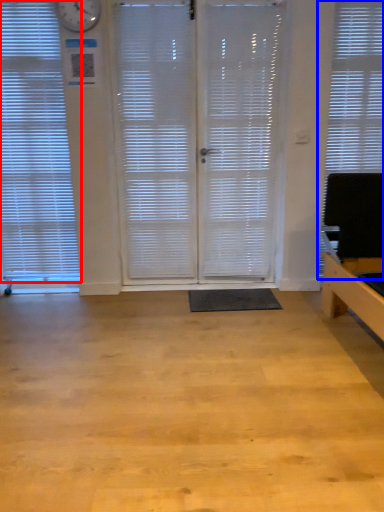
Question: Which of the following is the closest to the observer, window blind (highlighted by a red box) or window blind (highlighted by a blue box)?

Choices:
 (A) window blind
 (B) window blind

Answer: (A)